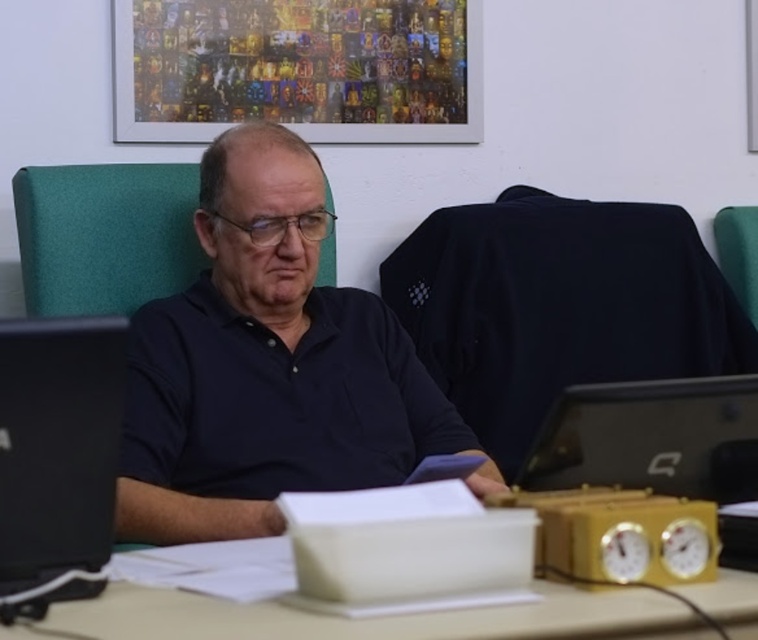
Image resolution: width=758 pixels, height=640 pixels. Describe the element at coordinates (558, 305) in the screenshot. I see `black fabric at center` at that location.

Does black fabric at center appear over black glossy laptop at left?

Yes, black fabric at center is above black glossy laptop at left.

The image size is (758, 640). What are the coordinates of `black fabric at center` in the screenshot? It's located at (558, 305).

Is dark blue shirt at center thinner than black fabric at center?

Yes.

Who is more forward, (199, 374) or (565, 346)?

Point (199, 374) is more forward.

I want to click on dark blue shirt at center, so (x=265, y=364).

Is point (462, 380) behind point (713, 435)?

Yes, point (462, 380) is behind point (713, 435).

Can you confirm if black fabric at center is wider than black glossy laptop at right?

Yes.

Between point (478, 387) and point (731, 396), which one is positioned behind?

The point (478, 387) is behind.

Identify the location of black fabric at center. (558, 305).